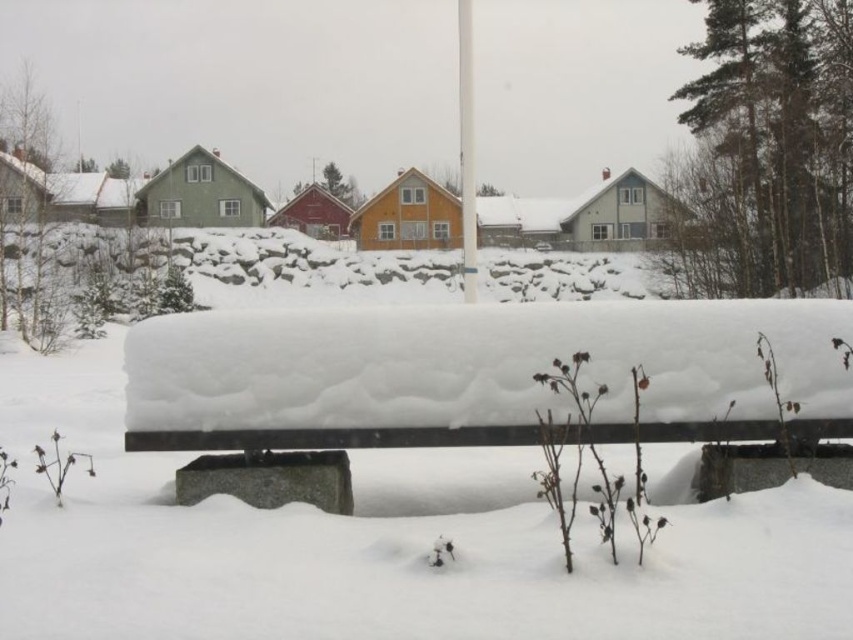
Question: Is the position of concrete bench at center less distant than that of white plastic pole at center?

Choices:
 (A) yes
 (B) no

Answer: (A)

Question: Which of the following is the farthest from the observer?

Choices:
 (A) concrete bench at center
 (B) white plastic pole at center

Answer: (B)

Question: Is concrete bench at center above white plastic pole at center?

Choices:
 (A) yes
 (B) no

Answer: (B)

Question: From the image, what is the correct spatial relationship of concrete bench at center in relation to white plastic pole at center?

Choices:
 (A) below
 (B) above

Answer: (A)